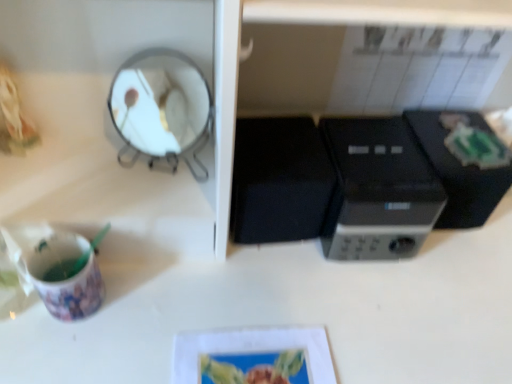
This screenshot has width=512, height=384. In order to click on vacant point above black plastic microwave at center (from a real-world perspective) in this screenshot , I will do `click(386, 136)`.